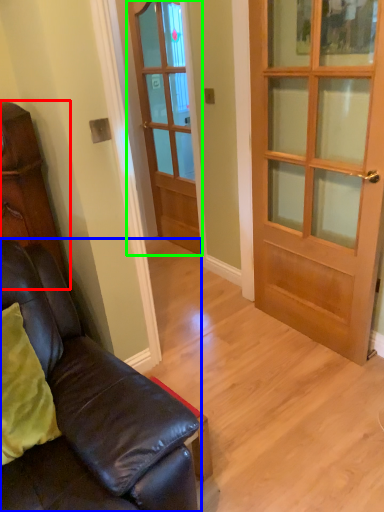
Question: Which object is the closest to the cabinetry (highlighted by a red box)? Choose among these: studio couch (highlighted by a blue box) or door (highlighted by a green box).

Choices:
 (A) studio couch
 (B) door

Answer: (A)